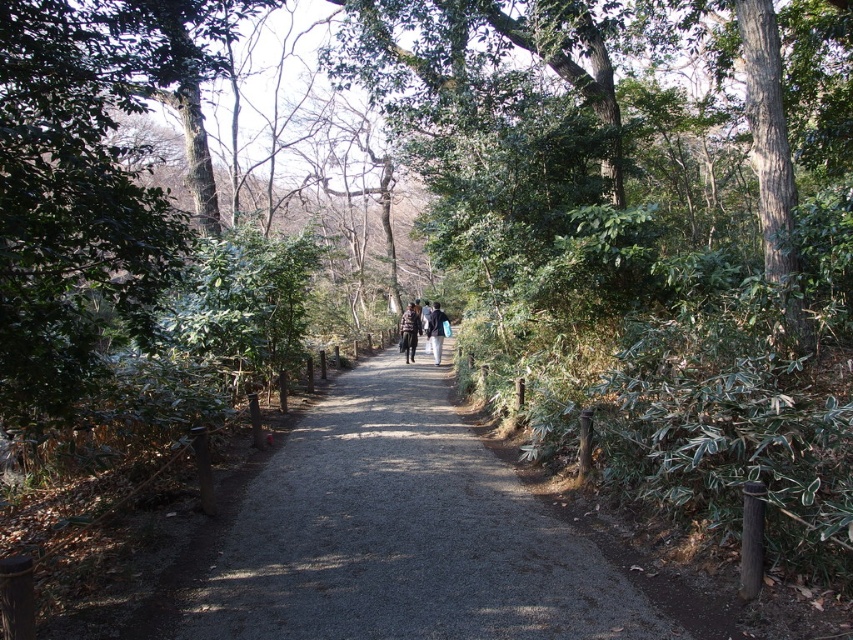
Question: Which of the following is the closest to the observer?

Choices:
 (A) (415, 316)
 (B) (399, 600)
 (C) (432, 326)

Answer: (B)

Question: Considering the real-world distances, which object is farthest from the dark blue jacket at center?

Choices:
 (A) plaid fabric jacket at center
 (B) gray gravel path at center

Answer: (B)

Question: Can you confirm if plaid fabric jacket at center is bigger than dark blue jacket at center?

Choices:
 (A) no
 (B) yes

Answer: (A)

Question: Is gray gravel path at center above plaid fabric jacket at center?

Choices:
 (A) yes
 (B) no

Answer: (B)

Question: Is the position of gray gravel path at center less distant than that of plaid fabric jacket at center?

Choices:
 (A) no
 (B) yes

Answer: (B)

Question: Considering the real-world distances, which object is closest to the gray gravel path at center?

Choices:
 (A) dark blue jacket at center
 (B) plaid fabric jacket at center

Answer: (A)